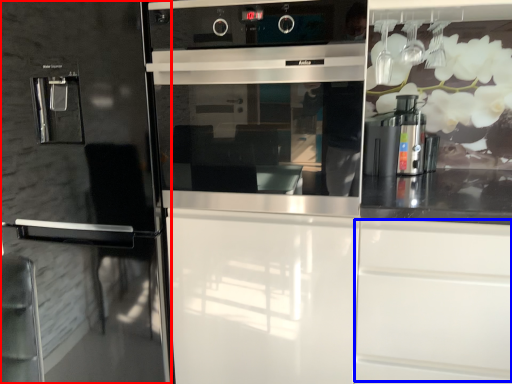
Question: Which object is closer to the camera taking this photo, fridge (highlighted by a red box) or drawer (highlighted by a blue box)?

Choices:
 (A) fridge
 (B) drawer

Answer: (B)